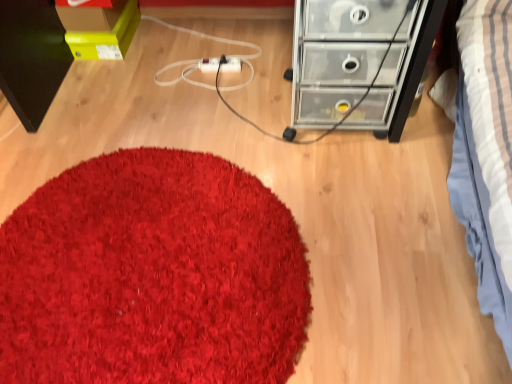
At what (x,y) coordinates should I click in order to perform the action: click on empty space that is to the right of white plastic extension cord at center. Please return your answer as a coordinate pair (x, y). Looking at the image, I should click on (259, 66).